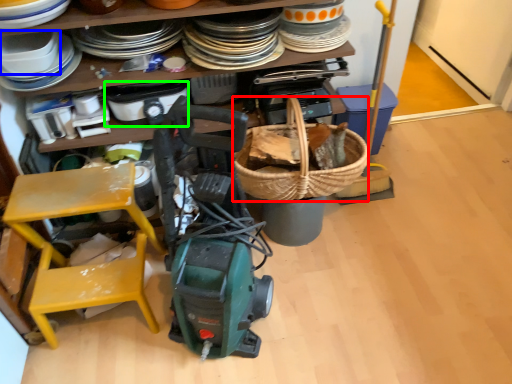
Question: Estimate the real-world distances between objects in this image. Which object is closer to basket (highlighted by a red box), appliance (highlighted by a blue box) or appliance (highlighted by a green box)?

Choices:
 (A) appliance
 (B) appliance

Answer: (B)